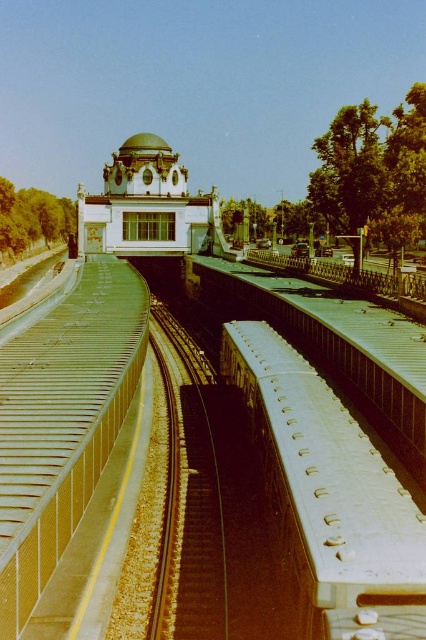
Consider the image. What is located at the coordinates point (x=330, y=497) in the image?

The point (x=330, y=497) indicates a white matte train at center.

You are standing at the yellow tactile paving strip near the railway tracks and want to take a photo of the white matte train at center from the best possible angle. Based on your position, where should you position yourself to capture the train in the frame?

Since the white matte train at center is located at coordinates approximately 0.777 on the x and y axes, positioning yourself at the yellow tactile paving strip directly in front of the train would allow you to center it in your frame for the best angle.